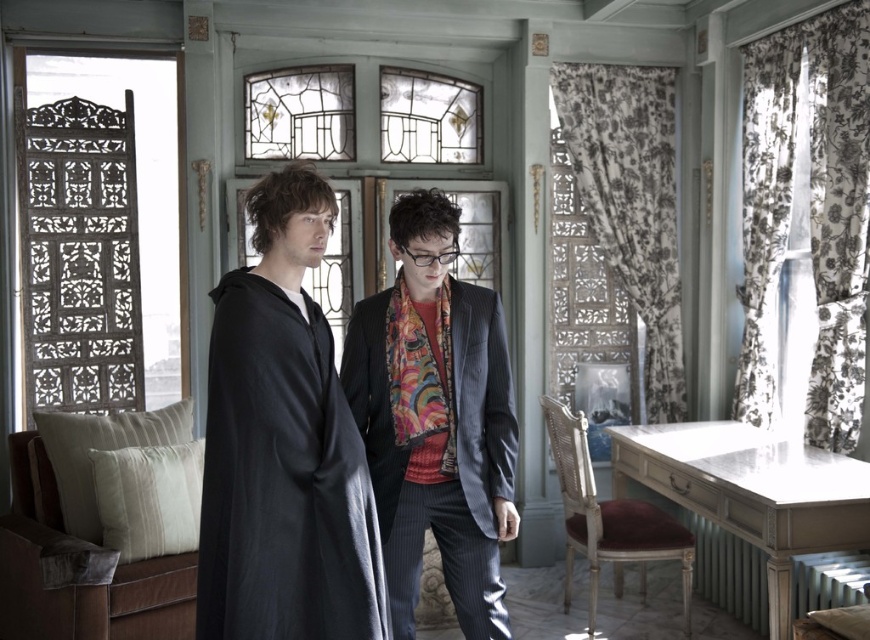
You are standing in the vintage room and want to hand a gift to the person wearing the velvet scarf at center without touching the matte black cloak at center. Is this possible given their positions?

The matte black cloak at center is closer to the viewer than the velvet scarf at center, so you can reach the velvet scarf at center without touching the matte black cloak at center.

You are an interior designer assessing the vintage room. You notice the matte black cloak at center and the velvet scarf at center. Which of these two items has a shorter vertical dimension?

The matte black cloak at center has a lesser height compared to the velvet scarf at center, so the matte black cloak at center is shorter vertically.